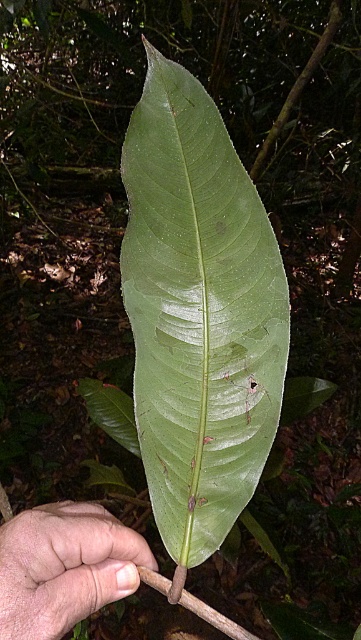
You are a botanist examining the image of a forest scene. You need to locate the green smooth leaf at center for analysis. According to the coordinates provided, where exactly is the green smooth leaf positioned in the image?

The green smooth leaf at center is located at point coordinates of (198, 312).

You are a botanist examining a plant specimen. You notice the green smooth leaf at center and the skinny flesh at lower left. Based on their positions, which one is closer to the ground?

The skinny flesh at lower left is closer to the ground because the green smooth leaf at center is located above it.